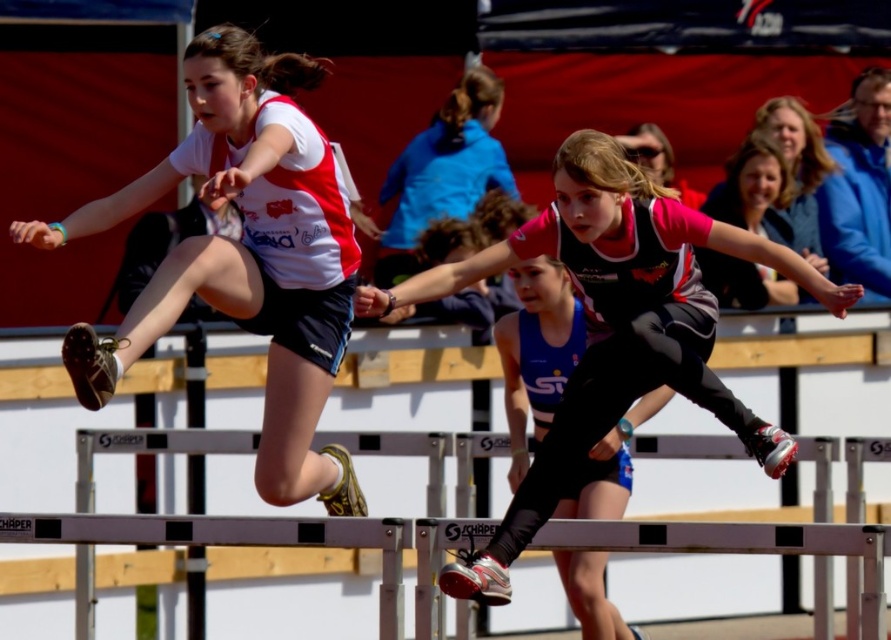
Which is more to the right, white matte shorts at left or matte black shorts at center?

Positioned to the right is matte black shorts at center.

From the picture: Which of these two, white matte shorts at left or matte black shorts at center, stands shorter?

matte black shorts at center is shorter.

Is point (226, 60) behind point (571, 248)?

That is False.

Find the location of `white matte shorts at left`. white matte shorts at left is located at coordinates (243, 256).